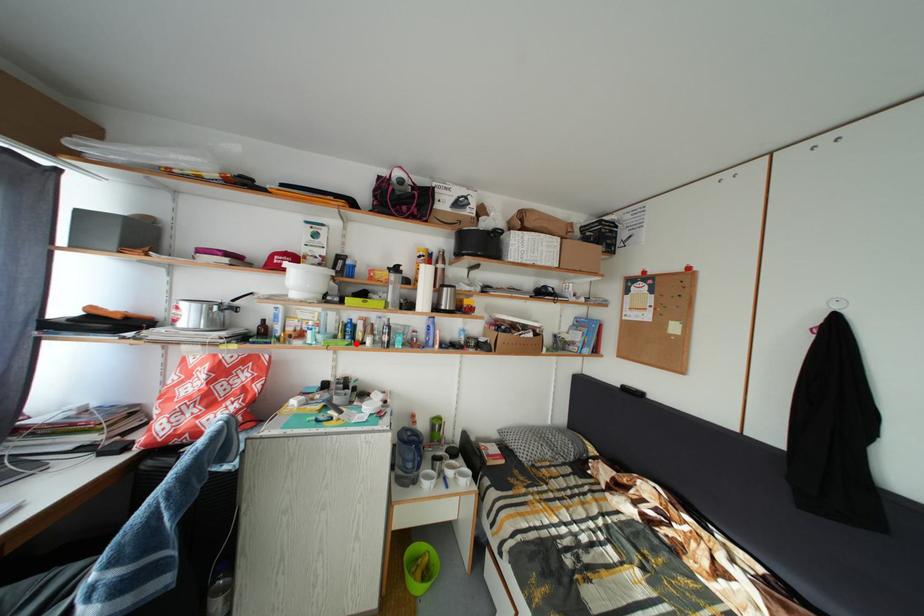
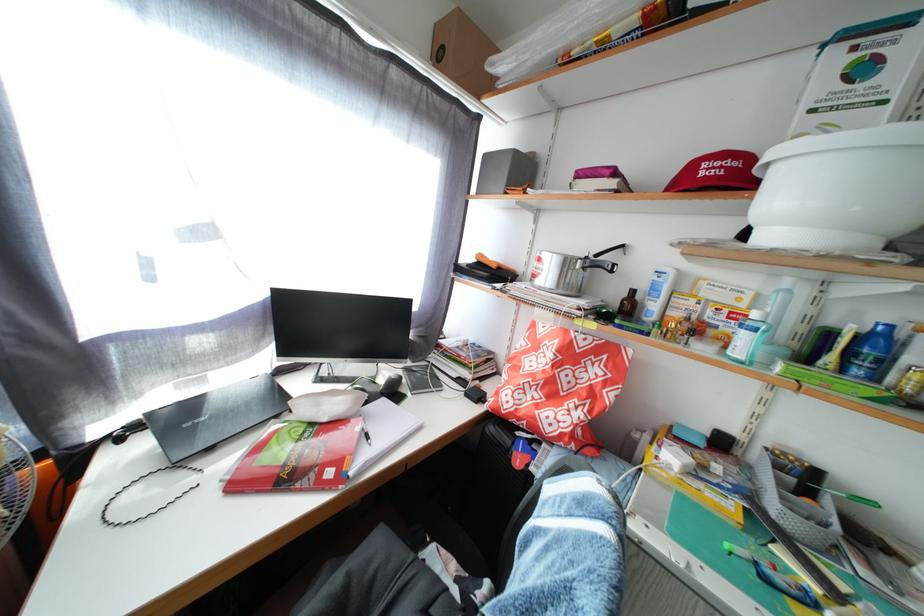
Locate, in the second image, the point that corresponds to the highlighted location in the first image.

(866, 378)